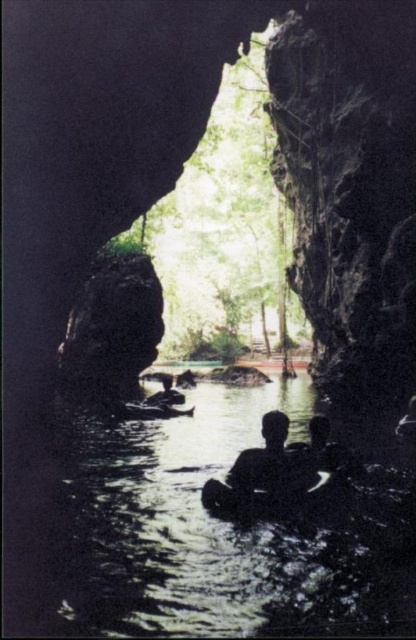
You are planning to take a boat ride in the cave. You have two options, the black rubber raft at center and the wooden canoe at center. Which one is closer to the water surface?

The black rubber raft at center is located below the wooden canoe at center, so it is closer to the water surface.

You are navigating a small boat in the cave. Your current position is at point (210, 532). You want to reach the exit located at point 0.9, 0.5. Can you safely move forward without hitting any obstacles?

The black rubber raft at center is located at point (210, 532). Since the exit is at point 0.9, 0.5, moving forward would bring you closer to the exit. However, there are no obstacles mentioned in the scene description, so it should be safe to proceed.

You are planning to take a photo of the black rubber raft at center and the silhouette human at center in the cave. Considering their sizes, which object should you focus on first to ensure it is in sharp focus?

The black rubber raft at center is much taller than the silhouette human at center, so you should focus on the black rubber raft at center first to ensure it is in sharp focus since it is larger and more prominent in the scene.